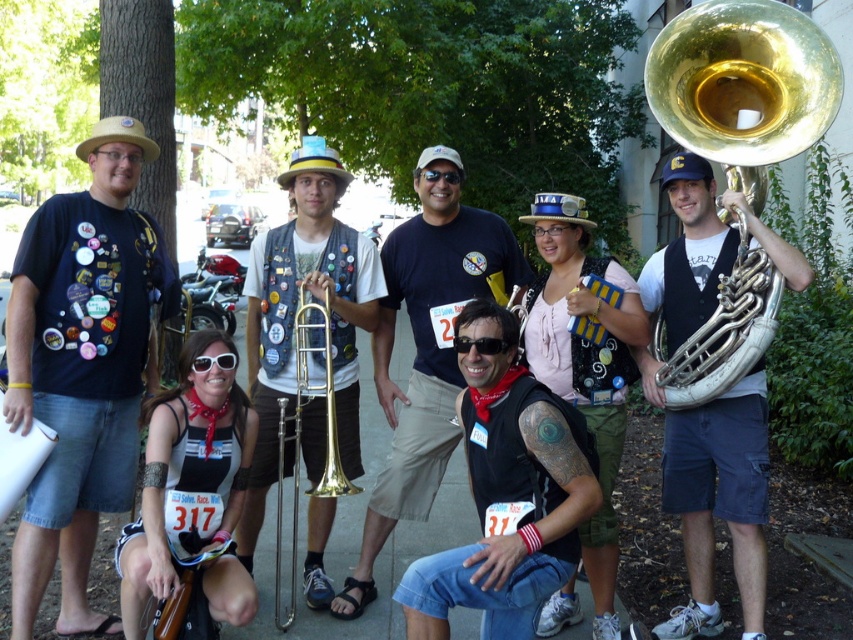
Is matte black t-shirt at left to the right of shiny brass trombone at center from the viewer's perspective?

Incorrect, matte black t-shirt at left is not on the right side of shiny brass trombone at center.

Find the location of a particular element. This screenshot has width=853, height=640. matte black t-shirt at left is located at coordinates (82, 365).

Does point (131, 364) come farther from viewer compared to point (260, 256)?

No, it is in front of (260, 256).

Where is `matte black t-shirt at left`? matte black t-shirt at left is located at coordinates (82, 365).

Who is taller, shiny brass trombone at center or black t-shirt at center?

Standing taller between the two is shiny brass trombone at center.

Based on the photo, can you confirm if shiny brass trombone at center is bigger than black t-shirt at center?

Yes, shiny brass trombone at center is bigger than black t-shirt at center.

Is point (294, 387) positioned after point (483, 296)?

No, it is in front of (483, 296).

Identify the location of shiny brass trombone at center. (294, 312).

Is point (250, 282) more distant than point (178, 573)?

That is True.

Does shiny brass trombone at center appear on the right side of brown wood trombone at lower left?

Indeed, shiny brass trombone at center is positioned on the right side of brown wood trombone at lower left.

Does point (311, 474) come closer to viewer compared to point (180, 620)?

That is False.

At what (x,y) coordinates should I click in order to perform the action: click on shiny brass trombone at center. Please return your answer as a coordinate pair (x, y). This screenshot has height=640, width=853. Looking at the image, I should click on (294, 312).